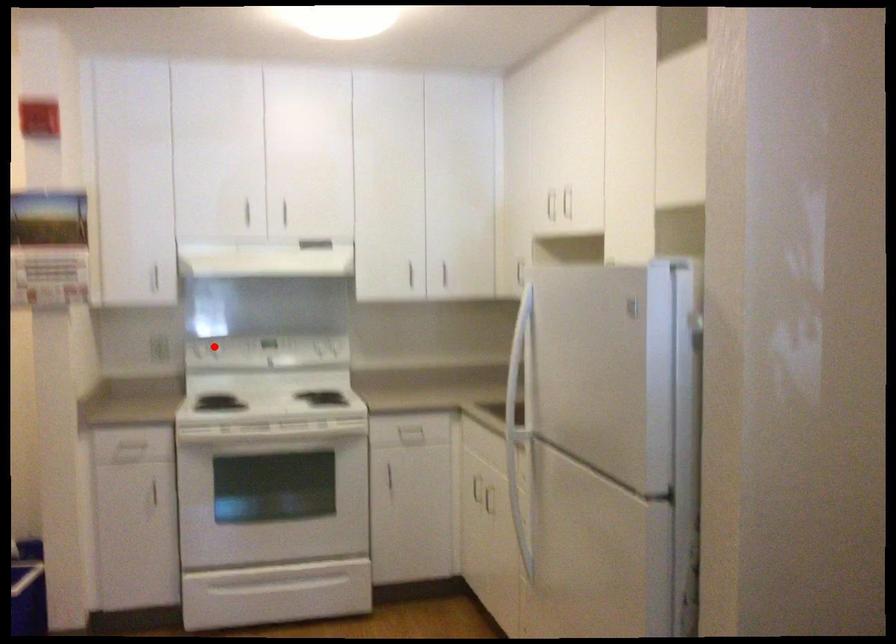
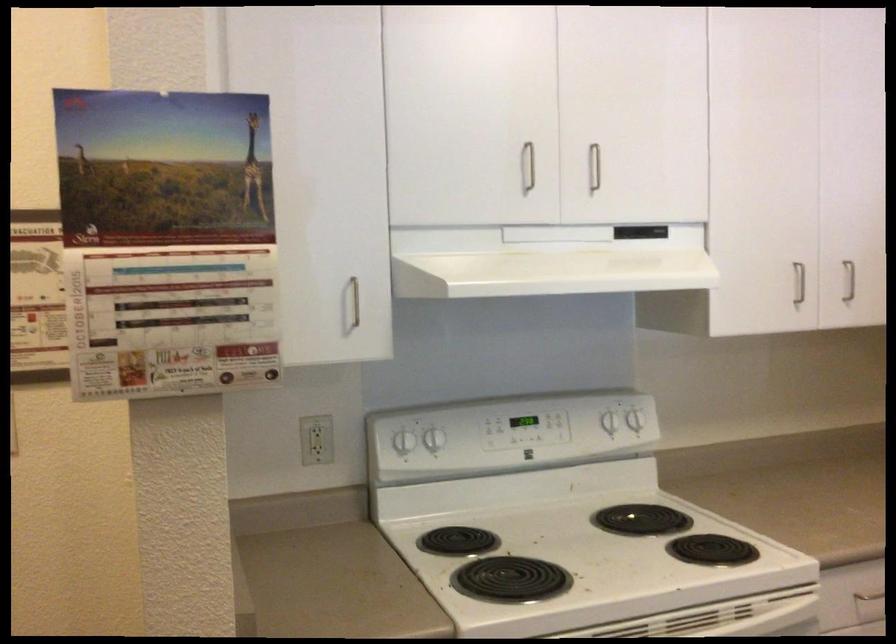
Question: I am providing you with two images of the same scene from different viewpoints. A red point is shown in image1. For the corresponding object point in image2, is it positioned nearer or farther from the camera?

Choices:
 (A) Nearer
 (B) Farther

Answer: (A)